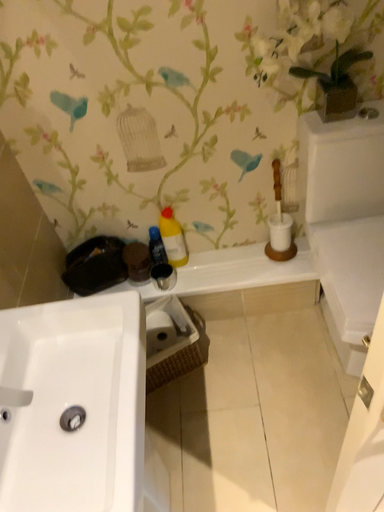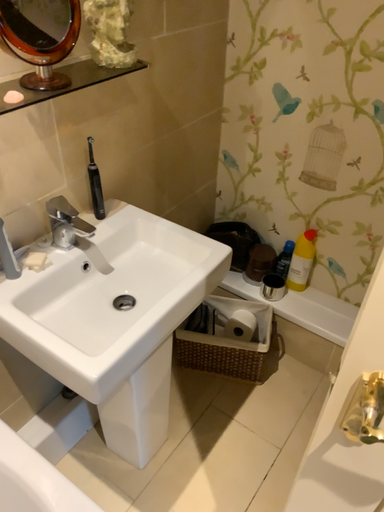
Question: Which way did the camera rotate in the video?

Choices:
 (A) rotated upward
 (B) rotated downward

Answer: (A)